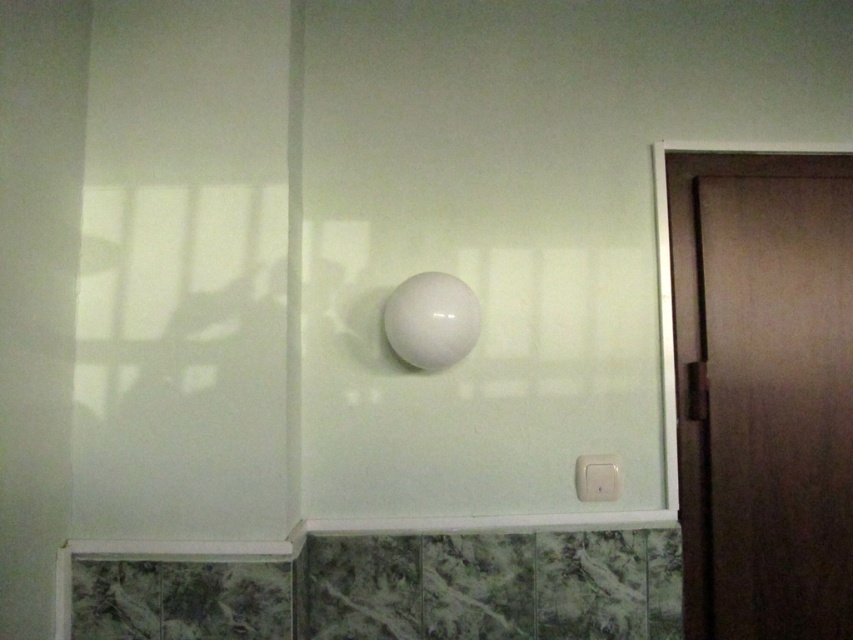
Question: Is brown matte door at right above white plastic light switch at lower right?

Choices:
 (A) yes
 (B) no

Answer: (A)

Question: Among these points, which one is farthest from the camera?

Choices:
 (A) (585, 454)
 (B) (689, 317)

Answer: (B)

Question: Does brown matte door at right have a lesser width compared to white plastic light switch at lower right?

Choices:
 (A) no
 (B) yes

Answer: (A)

Question: Is brown matte door at right closer to the viewer compared to white plastic light switch at lower right?

Choices:
 (A) yes
 (B) no

Answer: (A)

Question: Which object is closer to the camera taking this photo?

Choices:
 (A) white plastic light switch at lower right
 (B) brown matte door at right

Answer: (B)